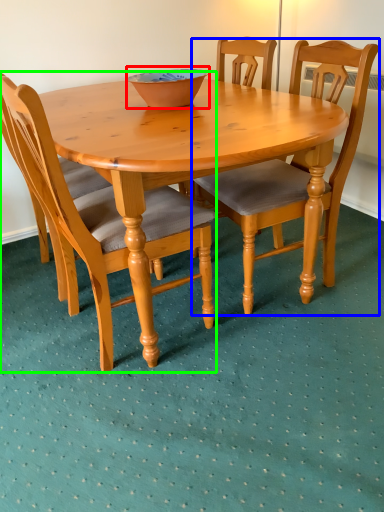
Question: Which is farther away from bowl (highlighted by a red box)? chair (highlighted by a blue box) or chair (highlighted by a green box)?

Choices:
 (A) chair
 (B) chair

Answer: (A)